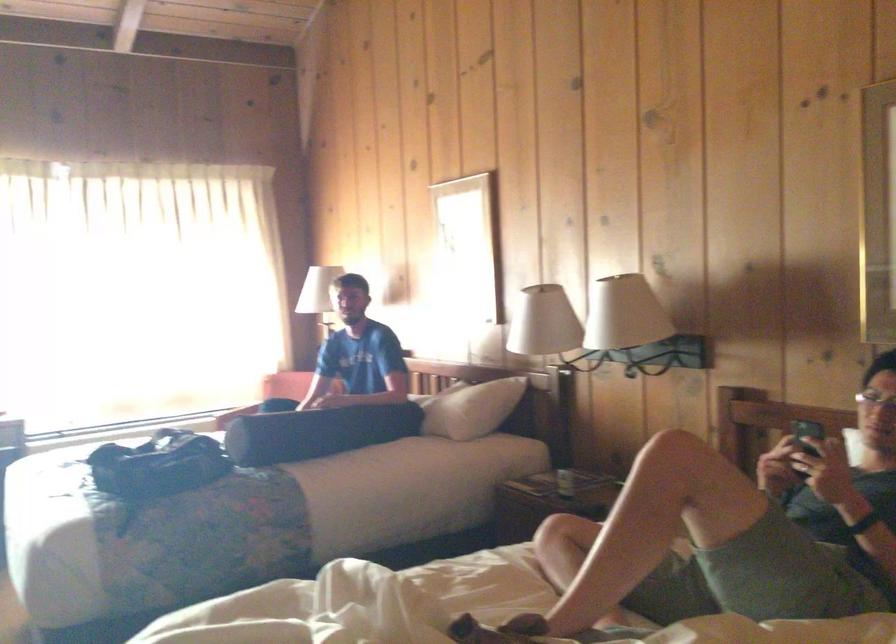
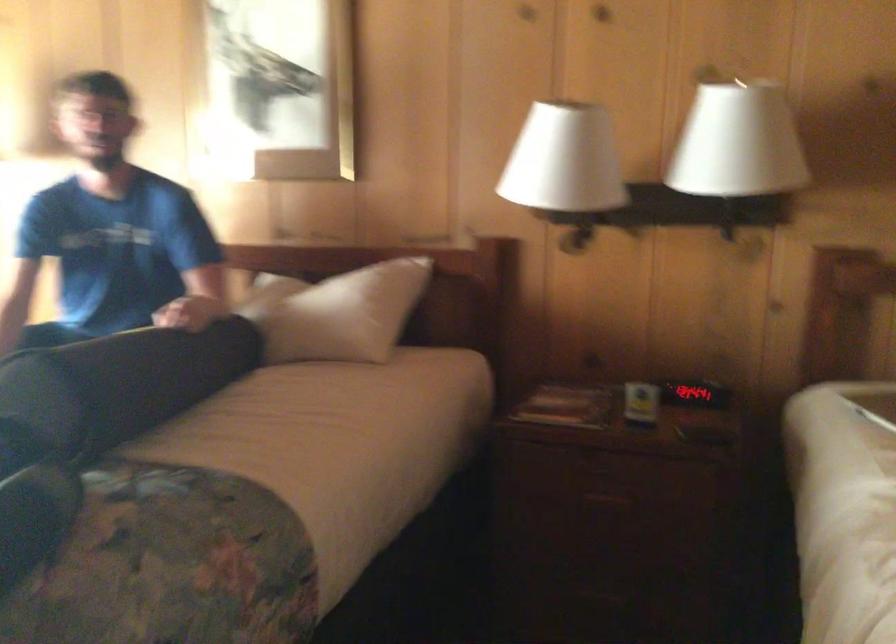
In the second image, find the point that corresponds to point 520,322 in the first image.

(564, 160)